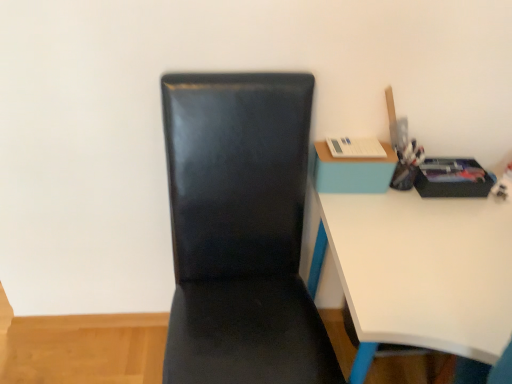
The image size is (512, 384). Identify the location of empty space that is ontop of blue matte table at upper right. (353, 150).